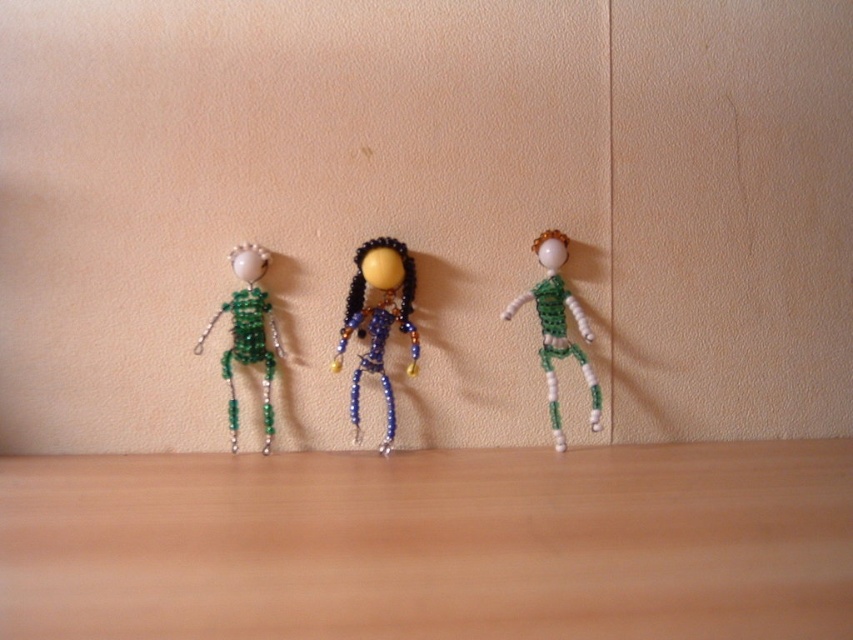
Is blue beaded doll at center to the left of green beaded figure at right from the viewer's perspective?

Correct, you'll find blue beaded doll at center to the left of green beaded figure at right.

Between point (396, 259) and point (547, 232), which one is positioned behind?

Positioned behind is point (547, 232).

I want to click on blue beaded doll at center, so click(378, 320).

Does wooden table at lower center have a lesser width compared to blue beaded doll at center?

In fact, wooden table at lower center might be wider than blue beaded doll at center.

Is wooden table at lower center behind blue beaded doll at center?

No.

I want to click on wooden table at lower center, so click(x=432, y=544).

Find the location of a particular element. The image size is (853, 640). wooden table at lower center is located at coordinates (432, 544).

Is wooden table at lower center taller than green beaded figure at right?

In fact, wooden table at lower center may be shorter than green beaded figure at right.

Is point (809, 548) positioned in front of point (549, 241)?

Yes, it is.

Which is in front, point (375, 500) or point (561, 344)?

Point (375, 500) is in front.

Image resolution: width=853 pixels, height=640 pixels. In order to click on wooden table at lower center in this screenshot , I will do `click(432, 544)`.